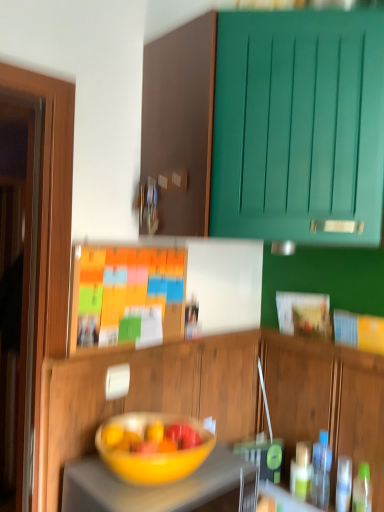
Question: Is transparent plastic bottle at right to the left or to the right of yellow matte bowl at center in the image?

Choices:
 (A) left
 (B) right

Answer: (B)

Question: Is transparent plastic bottle at right wider or thinner than yellow matte bowl at center?

Choices:
 (A) thin
 (B) wide

Answer: (A)

Question: Which of these objects is positioned farthest from the orange matte bulletin board at center?

Choices:
 (A) yellow matte bowl at center
 (B) teal wood cabinet at upper right, which ranks as the second cabinetry in bottom-to-top order
 (C) wooden cabinet at center, which is the 1th cabinetry from bottom to top
 (D) matte yellow bowl at center
 (E) transparent plastic bottle at right

Answer: (E)

Question: Which object is positioned farthest from the transparent plastic bottle at right?

Choices:
 (A) teal wood cabinet at upper right, which ranks as the second cabinetry in bottom-to-top order
 (B) yellow matte bowl at center
 (C) matte yellow bowl at center
 (D) orange matte bulletin board at center
 (E) wooden cabinet at center, which is the 1th cabinetry from bottom to top

Answer: (A)